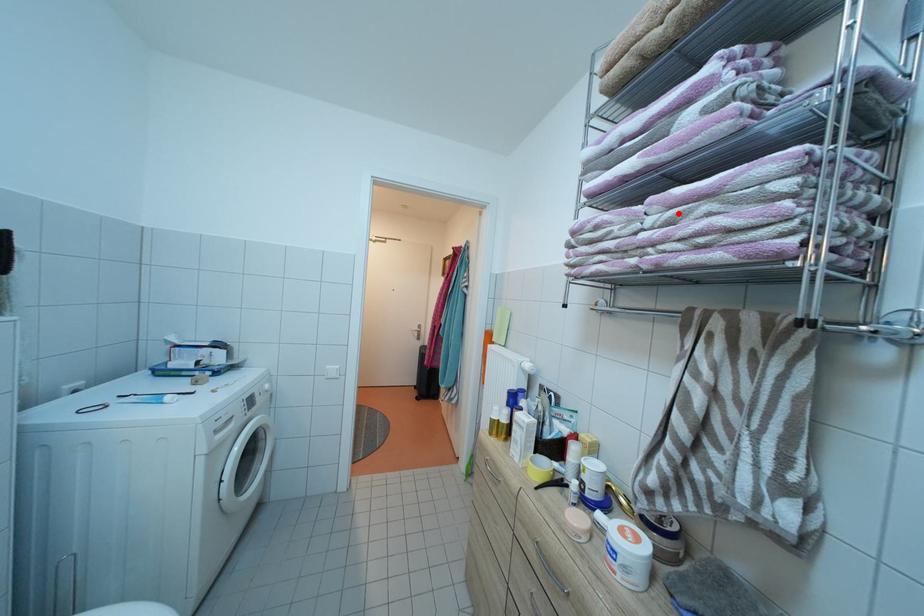
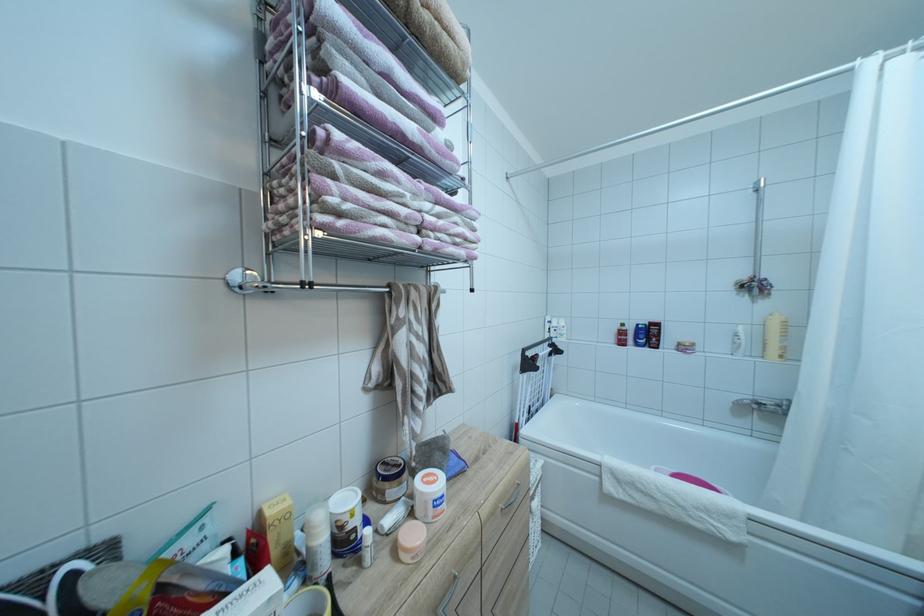
Locate, in the second image, the point that corresponds to the highlighted location in the first image.

(444, 209)